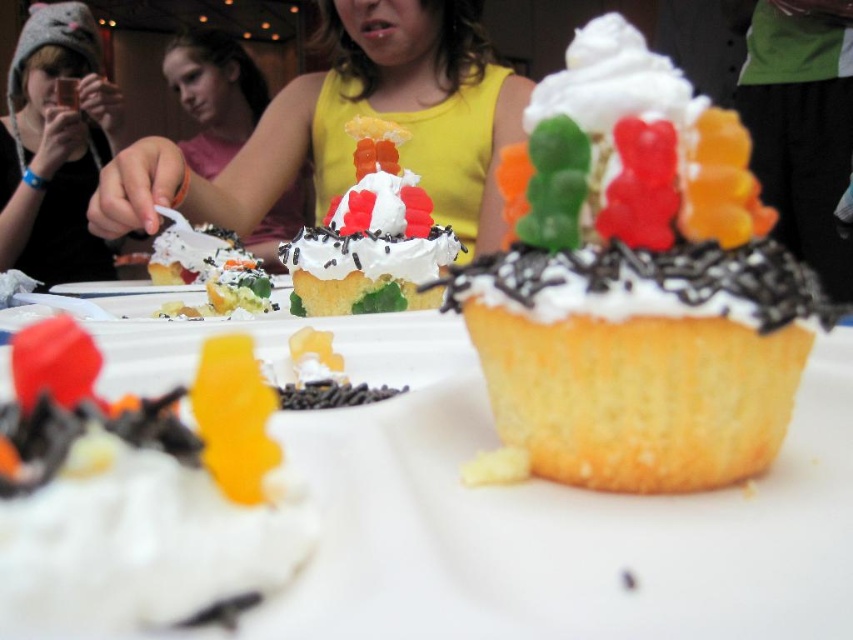
Is knitted gray hat at upper left bigger than gummy bear cupcake at center?

Correct, knitted gray hat at upper left is larger in size than gummy bear cupcake at center.

The height and width of the screenshot is (640, 853). I want to click on knitted gray hat at upper left, so click(x=54, y=147).

Where is `knitted gray hat at upper left`? Image resolution: width=853 pixels, height=640 pixels. knitted gray hat at upper left is located at coordinates (54, 147).

Between white fluffy frosting at center and knitted gray hat at upper left, which one has more height?

knitted gray hat at upper left is taller.

Is point (91, 481) farther from viewer compared to point (9, 262)?

No, (91, 481) is in front of (9, 262).

The image size is (853, 640). What are the coordinates of `white fluffy frosting at center` in the screenshot? It's located at 141,484.

You are a GUI agent. You are given a task and a screenshot of the screen. Output one action in this format:
    pyautogui.click(x=<x>, y=<y>)
    Task: Click on the white fluffy frosting at center
    
    Given the screenshot: What is the action you would take?
    pyautogui.click(x=141, y=484)

Is yellow cake with chocolate sprinkles at center positioned at the back of white fluffy frosting at center?

Yes.

How distant is yellow cake with chocolate sprinkles at center from white fluffy frosting at center?

yellow cake with chocolate sprinkles at center and white fluffy frosting at center are 7.70 inches apart from each other.

Does point (613, 284) lie behind point (184, 506)?

Yes, point (613, 284) is behind point (184, 506).

The width and height of the screenshot is (853, 640). I want to click on yellow cake with chocolate sprinkles at center, so click(636, 282).